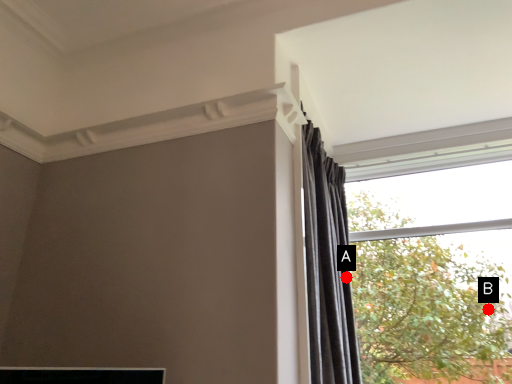
Question: Two points are circled on the image, labeled by A and B beside each circle. Which point is further to the camera?

Choices:
 (A) A is further
 (B) B is further

Answer: (B)